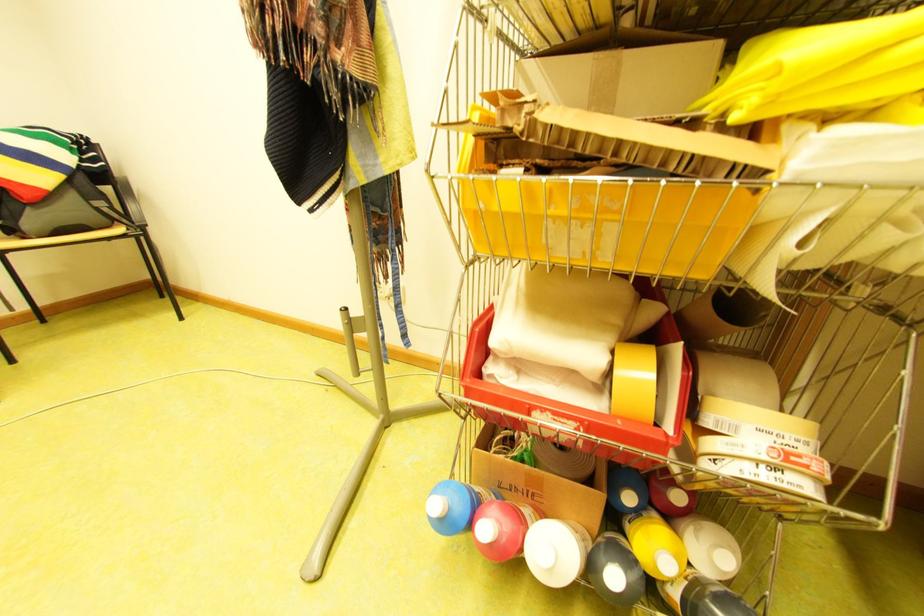
Find where to pull the yellow plastic bin. Please return your answer as a coordinate pair (x, y).

(612, 195)